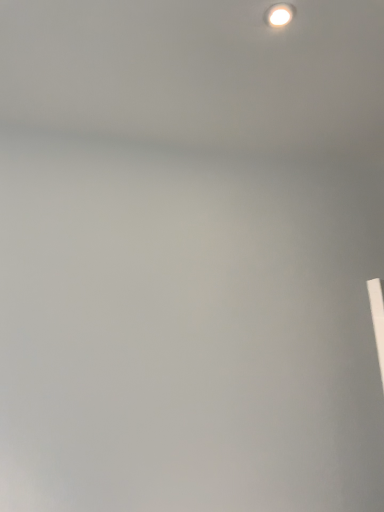
This screenshot has height=512, width=384. Find the location of `white glossy droplight at upper center`. white glossy droplight at upper center is located at coordinates (279, 15).

Describe the element at coordinates (279, 15) in the screenshot. This screenshot has height=512, width=384. I see `white glossy droplight at upper center` at that location.

This screenshot has height=512, width=384. Find the location of `white glossy droplight at upper center`. white glossy droplight at upper center is located at coordinates (279, 15).